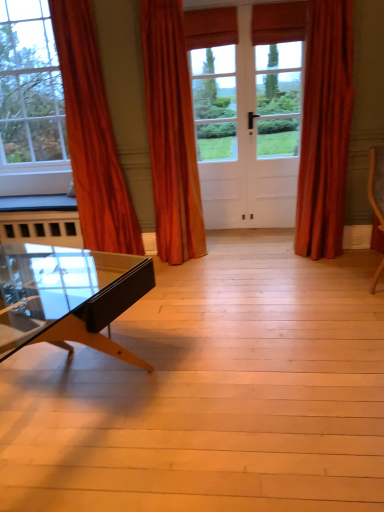
This screenshot has width=384, height=512. What are the coordinates of `orange velvet curtain at left, the 3th curtain when ordered from right to left` in the screenshot? It's located at (92, 135).

Identify the location of velvet orange curtain at right, the 1th curtain in the right-to-left sequence. (325, 129).

You are a GUI agent. You are given a task and a screenshot of the screen. Output one action in this format:
    pyautogui.click(x=<x>, y=<y>)
    Task: Click on the curtain in front of the orange velvet curtain at center, which is the 2th curtain from left to right
    
    Given the screenshot: What is the action you would take?
    pyautogui.click(x=92, y=135)

Between orange velvet curtain at center, the 2th curtain positioned from the right, and orange velvet curtain at left, the 1th curtain when ordered from left to right, which one has larger width?

orange velvet curtain at left, the 1th curtain when ordered from left to right, is wider.

In the image, is orange velvet curtain at center, which is the 2th curtain from left to right, positioned in front of or behind orange velvet curtain at left, the 1th curtain when ordered from left to right?

orange velvet curtain at center, which is the 2th curtain from left to right, is behind orange velvet curtain at left, the 1th curtain when ordered from left to right.

Considering the points (91, 141) and (160, 200), which point is behind, point (91, 141) or point (160, 200)?

The point (160, 200) is farther.

Who is taller, orange velvet curtain at left, the 3th curtain when ordered from right to left, or orange velvet curtain at center, which is the 2th curtain from left to right?

orange velvet curtain at left, the 3th curtain when ordered from right to left, is taller.

Which object is further away from the camera taking this photo, orange velvet curtain at left, the 3th curtain when ordered from right to left, or orange velvet curtain at center, the 2th curtain positioned from the right?

orange velvet curtain at center, the 2th curtain positioned from the right, is behind.

From the image's perspective, is orange velvet curtain at left, the 3th curtain when ordered from right to left, on top of orange velvet curtain at center, which is the 2th curtain from left to right?

Incorrect, from the image's perspective, orange velvet curtain at left, the 3th curtain when ordered from right to left, is lower than orange velvet curtain at center, which is the 2th curtain from left to right.

From a real-world perspective, which is physically below, velvet orange curtain at right, the 1th curtain in the right-to-left sequence, or orange velvet curtain at left, the 3th curtain when ordered from right to left?

velvet orange curtain at right, the 1th curtain in the right-to-left sequence, is physically lower.

Is velvet orange curtain at right, which is the 3th curtain in left-to-right order, further to the viewer compared to orange velvet curtain at left, the 1th curtain when ordered from left to right?

That is True.

Are velvet orange curtain at right, the 1th curtain in the right-to-left sequence, and orange velvet curtain at left, the 3th curtain when ordered from right to left, located far from each other?

velvet orange curtain at right, the 1th curtain in the right-to-left sequence, is far away from orange velvet curtain at left, the 3th curtain when ordered from right to left.

Is orange velvet curtain at left, the 3th curtain when ordered from right to left, at the back of velvet orange curtain at right, the 1th curtain in the right-to-left sequence?

No, velvet orange curtain at right, the 1th curtain in the right-to-left sequence, is not facing away from orange velvet curtain at left, the 3th curtain when ordered from right to left.

From the image's perspective, which is below, velvet orange curtain at right, the 1th curtain in the right-to-left sequence, or orange velvet curtain at center, the 2th curtain positioned from the right?

velvet orange curtain at right, the 1th curtain in the right-to-left sequence, from the image's perspective.

Is velvet orange curtain at right, the 1th curtain in the right-to-left sequence, smaller than orange velvet curtain at center, which is the 2th curtain from left to right?

Yes, velvet orange curtain at right, the 1th curtain in the right-to-left sequence, is smaller than orange velvet curtain at center, which is the 2th curtain from left to right.

Is velvet orange curtain at right, which is the 3th curtain in left-to-right order, aimed at orange velvet curtain at center, the 2th curtain positioned from the right?

No, velvet orange curtain at right, which is the 3th curtain in left-to-right order, is not oriented towards orange velvet curtain at center, the 2th curtain positioned from the right.

Based on the photo, does velvet orange curtain at right, which is the 3th curtain in left-to-right order, lie behind orange velvet curtain at center, which is the 2th curtain from left to right?

Yes, the depth of velvet orange curtain at right, which is the 3th curtain in left-to-right order, is greater than that of orange velvet curtain at center, which is the 2th curtain from left to right.

From a real-world perspective, is orange velvet curtain at left, the 3th curtain when ordered from right to left, below velvet orange curtain at right, the 1th curtain in the right-to-left sequence?

No.

Between orange velvet curtain at left, the 3th curtain when ordered from right to left, and velvet orange curtain at right, the 1th curtain in the right-to-left sequence, which one has smaller width?

velvet orange curtain at right, the 1th curtain in the right-to-left sequence, is thinner.

From their relative heights in the image, would you say orange velvet curtain at left, the 1th curtain when ordered from left to right, is taller or shorter than velvet orange curtain at right, which is the 3th curtain in left-to-right order?

Clearly, orange velvet curtain at left, the 1th curtain when ordered from left to right, is taller compared to velvet orange curtain at right, which is the 3th curtain in left-to-right order.

This screenshot has height=512, width=384. In order to click on the 2nd curtain located above the velvet orange curtain at right, which is the 3th curtain in left-to-right order (from a real-world perspective) in this screenshot , I will do `click(92, 135)`.

Is orange velvet curtain at center, the 2th curtain positioned from the right, shorter than velvet orange curtain at right, the 1th curtain in the right-to-left sequence?

No, orange velvet curtain at center, the 2th curtain positioned from the right, is not shorter than velvet orange curtain at right, the 1th curtain in the right-to-left sequence.

Is point (197, 179) closer to camera compared to point (314, 139)?

No, (197, 179) is behind (314, 139).

From the image's perspective, would you say orange velvet curtain at center, which is the 2th curtain from left to right, is shown under velvet orange curtain at right, which is the 3th curtain in left-to-right order?

Incorrect, from the image's perspective, orange velvet curtain at center, which is the 2th curtain from left to right, is higher than velvet orange curtain at right, which is the 3th curtain in left-to-right order.

Who is bigger, orange velvet curtain at center, the 2th curtain positioned from the right, or velvet orange curtain at right, the 1th curtain in the right-to-left sequence?

With larger size is orange velvet curtain at center, the 2th curtain positioned from the right.

From a real-world perspective, count 1st curtains downward from the orange velvet curtain at left, the 3th curtain when ordered from right to left, and point to it. Please provide its 2D coordinates.

[(171, 133)]

Locate an element on the screen. This screenshot has width=384, height=512. the 1st curtain behind the orange velvet curtain at left, the 1th curtain when ordered from left to right, counting from the anchor's position is located at coordinates (171, 133).

From the image, which object appears to be nearer to orange velvet curtain at left, the 1th curtain when ordered from left to right, velvet orange curtain at right, which is the 3th curtain in left-to-right order, or orange velvet curtain at center, which is the 2th curtain from left to right?

The object closer to orange velvet curtain at left, the 1th curtain when ordered from left to right, is orange velvet curtain at center, which is the 2th curtain from left to right.

Looking at this image, when comparing their distances from velvet orange curtain at right, which is the 3th curtain in left-to-right order, does orange velvet curtain at center, which is the 2th curtain from left to right, or orange velvet curtain at left, the 3th curtain when ordered from right to left, seem closer?

orange velvet curtain at center, which is the 2th curtain from left to right, is closer to velvet orange curtain at right, which is the 3th curtain in left-to-right order.

From the image, which object appears to be farther from velvet orange curtain at right, the 1th curtain in the right-to-left sequence, orange velvet curtain at left, the 3th curtain when ordered from right to left, or orange velvet curtain at center, the 2th curtain positioned from the right?

orange velvet curtain at left, the 3th curtain when ordered from right to left, lies further to velvet orange curtain at right, the 1th curtain in the right-to-left sequence, than the other object.

From the image, which object appears to be nearer to orange velvet curtain at left, the 1th curtain when ordered from left to right, orange velvet curtain at center, the 2th curtain positioned from the right, or velvet orange curtain at right, which is the 3th curtain in left-to-right order?

Based on the image, orange velvet curtain at center, the 2th curtain positioned from the right, appears to be nearer to orange velvet curtain at left, the 1th curtain when ordered from left to right.

Looking at the image, which one is located closer to orange velvet curtain at center, the 2th curtain positioned from the right, velvet orange curtain at right, the 1th curtain in the right-to-left sequence, or orange velvet curtain at left, the 3th curtain when ordered from right to left?

The object closer to orange velvet curtain at center, the 2th curtain positioned from the right, is orange velvet curtain at left, the 3th curtain when ordered from right to left.

Looking at this image, when comparing their distances from orange velvet curtain at center, the 2th curtain positioned from the right, does orange velvet curtain at left, the 1th curtain when ordered from left to right, or velvet orange curtain at right, which is the 3th curtain in left-to-right order, seem further?

velvet orange curtain at right, which is the 3th curtain in left-to-right order.

Where is `curtain between orange velvet curtain at left, the 1th curtain when ordered from left to right, and velvet orange curtain at right, the 1th curtain in the right-to-left sequence, from left to right`? This screenshot has height=512, width=384. curtain between orange velvet curtain at left, the 1th curtain when ordered from left to right, and velvet orange curtain at right, the 1th curtain in the right-to-left sequence, from left to right is located at coordinates (171, 133).